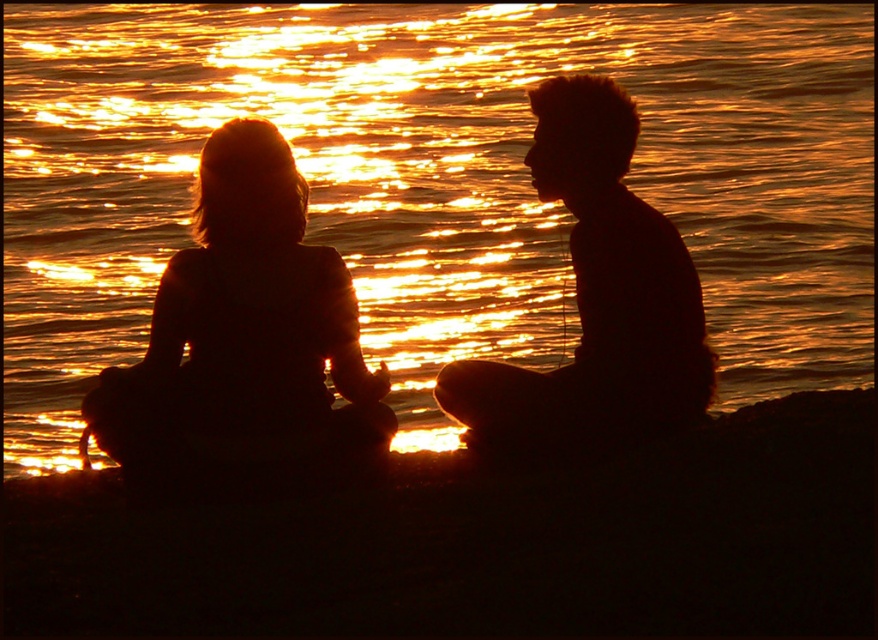
In the scene shown: You are a photographer trying to capture the sunset scene. You notice the silhouette hair at left and the golden reflective water at center. Which object is closer to the camera? Please explain your reasoning based on their positions.

The golden reflective water at center is closer to the camera because the silhouette hair at left is positioned behind it, meaning the water is in front of the hair in the scene.